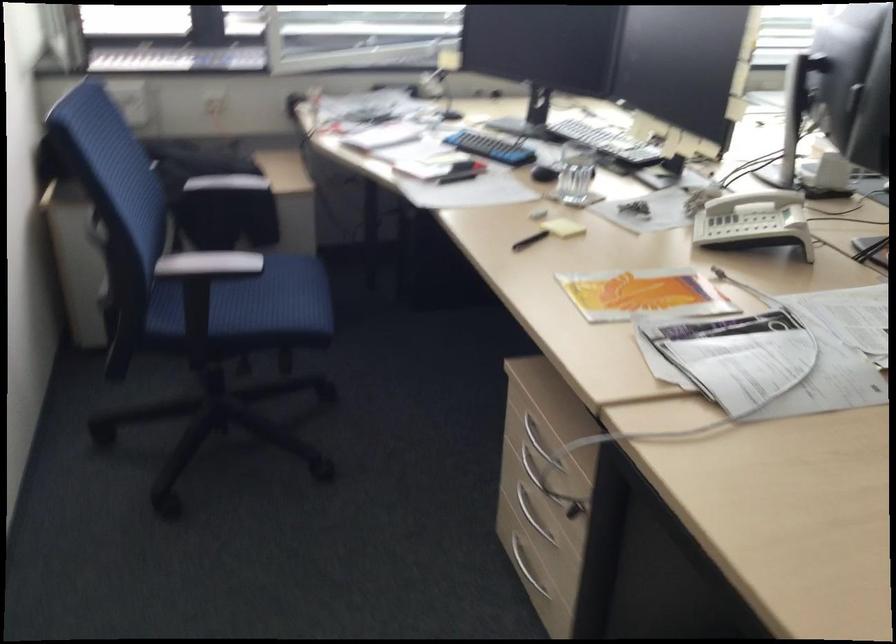
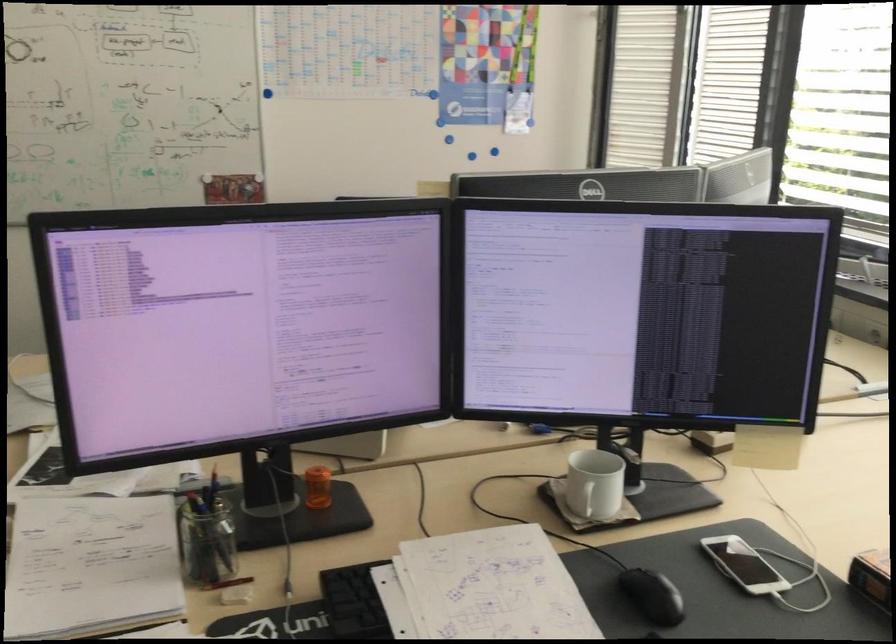
Question: I am providing you with two images of the same scene from different viewpoints. Which of the following objects are not visible in image2?

Choices:
 (A) white smartphone
 (B) red cooking pot
 (C) glass pencil holder
 (D) black computer mouse

Answer: (D)